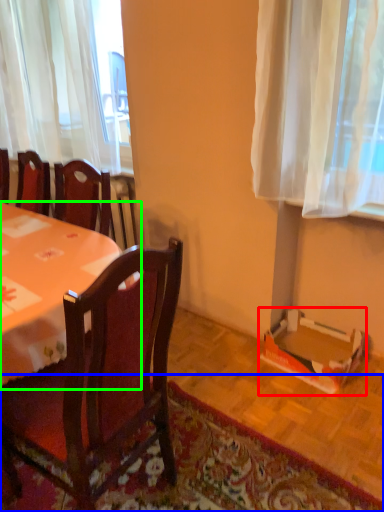
Question: Considering the real-world distances, which object is farthest from cardboard box (highlighted by a red box)? mat (highlighted by a blue box) or desk (highlighted by a green box)?

Choices:
 (A) mat
 (B) desk

Answer: (B)